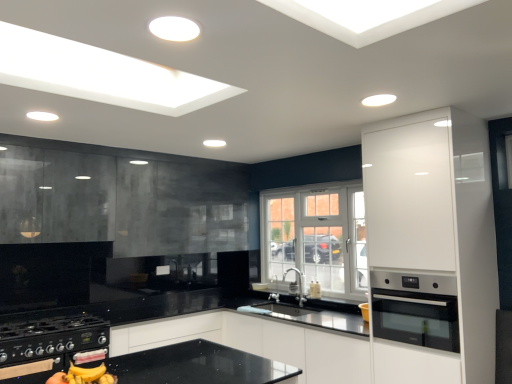
The image size is (512, 384). What do you see at coordinates (415, 309) in the screenshot? I see `stainless steel oven at right` at bounding box center [415, 309].

At what (x,y) coordinates should I click in order to perform the action: click on stainless steel oven at right. Please return your answer as a coordinate pair (x, y). Image resolution: width=512 pixels, height=384 pixels. Looking at the image, I should click on (415, 309).

You are a GUI agent. You are given a task and a screenshot of the screen. Output one action in this format:
    pyautogui.click(x=<x>, y=<y>)
    Task: Click on the white textured window at center
    
    Given the screenshot: What is the action you would take?
    pyautogui.click(x=316, y=237)

Does point (48, 341) come in front of point (300, 287)?

Yes, point (48, 341) is in front of point (300, 287).

Is black matte gas stove at lower left next to satin nickel faucet at center and touching it?

No, black matte gas stove at lower left is not making contact with satin nickel faucet at center.

What are the coordinates of `gas stove below the satin nickel faucet at center (from a real-world perspective)` in the screenshot? It's located at (51, 337).

Which of these two, black matte gas stove at lower left or black glass cabinet at upper left, which is the 1th cabinetry in left-to-right order, stands shorter?

black matte gas stove at lower left.

Is black matte gas stove at lower left oriented towards black glass cabinet at upper left, acting as the second cabinetry starting from the right?

No.

Is black glass cabinet at upper left, acting as the second cabinetry starting from the right, completely or partially inside black matte gas stove at lower left?

No, black glass cabinet at upper left, acting as the second cabinetry starting from the right, is not surrounded by black matte gas stove at lower left.

Does black matte gas stove at lower left have a greater width compared to black glass cabinet at upper left, acting as the second cabinetry starting from the right?

Indeed, black matte gas stove at lower left has a greater width compared to black glass cabinet at upper left, acting as the second cabinetry starting from the right.

Considering the sizes of satin nickel faucet at center and white glossy cabinet at right, which is the second cabinetry in back-to-front order, in the image, is satin nickel faucet at center bigger or smaller than white glossy cabinet at right, which is the second cabinetry in back-to-front order,?

In the image, satin nickel faucet at center appears to be smaller than white glossy cabinet at right, which is the second cabinetry in back-to-front order.

Considering the positions of objects satin nickel faucet at center and white glossy cabinet at right, the first cabinetry from the front, in the image provided, who is behind, satin nickel faucet at center or white glossy cabinet at right, the first cabinetry from the front,?

satin nickel faucet at center.

From a real-world perspective, who is located lower, satin nickel faucet at center or white glossy cabinet at right, the 2th cabinetry positioned from the left?

From a 3D spatial view, satin nickel faucet at center is below.

Looking at this image, is satin nickel faucet at center positioned with its back to white glossy cabinet at right, the 2th cabinetry positioned from the left?

No.

Is black glass cabinet at upper left, the 2th cabinetry from the front, aimed at white textured window at center?

Yes, black glass cabinet at upper left, the 2th cabinetry from the front, is oriented towards white textured window at center.

From a real-world perspective, is black glass cabinet at upper left, which is the first cabinetry from back to front, beneath white textured window at center?

No, from a real-world perspective, black glass cabinet at upper left, which is the first cabinetry from back to front, is not under white textured window at center.

Who is smaller, black glass cabinet at upper left, which is the first cabinetry from back to front, or white textured window at center?

white textured window at center is smaller.

Is black glass cabinet at upper left, the 2th cabinetry from the front, taller or shorter than white textured window at center?

Considering their sizes, black glass cabinet at upper left, the 2th cabinetry from the front, has less height than white textured window at center.

Would you say black matte gas stove at lower left contains white glossy cabinet at right, the 2th cabinetry positioned from the left?

No, black matte gas stove at lower left does not contain white glossy cabinet at right, the 2th cabinetry positioned from the left.

Does black matte gas stove at lower left have a greater width compared to white glossy cabinet at right, the 2th cabinetry positioned from the left?

In fact, black matte gas stove at lower left might be narrower than white glossy cabinet at right, the 2th cabinetry positioned from the left.

Is black matte gas stove at lower left not close to white glossy cabinet at right, which is the second cabinetry in back-to-front order?

Indeed, black matte gas stove at lower left is not near white glossy cabinet at right, which is the second cabinetry in back-to-front order.

Where is `cabinetry below the black glass cabinet at upper left, the 2th cabinetry from the front (from the image's perspective)`? The height and width of the screenshot is (384, 512). cabinetry below the black glass cabinet at upper left, the 2th cabinetry from the front (from the image's perspective) is located at coordinates (432, 240).

Considering the relative sizes of white glossy cabinet at right, which is the second cabinetry in back-to-front order, and black glass cabinet at upper left, which is the 1th cabinetry in left-to-right order, in the image provided, is white glossy cabinet at right, which is the second cabinetry in back-to-front order, thinner than black glass cabinet at upper left, which is the 1th cabinetry in left-to-right order,?

No, white glossy cabinet at right, which is the second cabinetry in back-to-front order, is not thinner than black glass cabinet at upper left, which is the 1th cabinetry in left-to-right order.

How far apart are white glossy cabinet at right, acting as the first cabinetry starting from the right, and black glass cabinet at upper left, the 2th cabinetry from the front?

A distance of 7.51 feet exists between white glossy cabinet at right, acting as the first cabinetry starting from the right, and black glass cabinet at upper left, the 2th cabinetry from the front.

Who is bigger, white glossy cabinet at right, which is the second cabinetry in back-to-front order, or black glass cabinet at upper left, which is the first cabinetry from back to front?

black glass cabinet at upper left, which is the first cabinetry from back to front.

Is satin nickel faucet at center bigger than white textured window at center?

No, satin nickel faucet at center is not bigger than white textured window at center.

Is there a large distance between satin nickel faucet at center and white textured window at center?

No, there isn't a large distance between satin nickel faucet at center and white textured window at center.

Who is shorter, satin nickel faucet at center or white textured window at center?

satin nickel faucet at center is shorter.

The height and width of the screenshot is (384, 512). What are the coordinates of `tap that is on the right side of black matte gas stove at lower left` in the screenshot? It's located at (298, 284).

Where is `gas stove below the black glass cabinet at upper left, which is the first cabinetry from back to front (from the image's perspective)`? gas stove below the black glass cabinet at upper left, which is the first cabinetry from back to front (from the image's perspective) is located at coordinates (51, 337).

Considering their positions, is black glass cabinet at upper left, the 2th cabinetry from the front, positioned further to white glossy cabinet at right, acting as the first cabinetry starting from the right, than white textured window at center?

Based on the image, black glass cabinet at upper left, the 2th cabinetry from the front, appears to be further to white glossy cabinet at right, acting as the first cabinetry starting from the right.

Estimate the real-world distances between objects in this image. Which object is closer to white glossy cabinet at right, acting as the first cabinetry starting from the right, black glass cabinet at upper left, acting as the second cabinetry starting from the right, or stainless steel oven at right?

stainless steel oven at right is closer to white glossy cabinet at right, acting as the first cabinetry starting from the right.

Looking at the image, which one is located closer to satin nickel faucet at center, black matte gas stove at lower left or white textured window at center?

white textured window at center is closer to satin nickel faucet at center.

Based on their spatial positions, is stainless steel oven at right or white glossy cabinet at right, which is the second cabinetry in back-to-front order, closer to black matte gas stove at lower left?

Based on the image, stainless steel oven at right appears to be nearer to black matte gas stove at lower left.

Estimate the real-world distances between objects in this image. Which object is closer to black glass cabinet at upper left, which is the 1th cabinetry in left-to-right order, satin nickel faucet at center or stainless steel oven at right?

satin nickel faucet at center lies closer to black glass cabinet at upper left, which is the 1th cabinetry in left-to-right order, than the other object.

Estimate the real-world distances between objects in this image. Which object is further from black matte gas stove at lower left, stainless steel oven at right or white textured window at center?

stainless steel oven at right is positioned further to the anchor black matte gas stove at lower left.

Which object lies nearer to the anchor point white textured window at center, satin nickel faucet at center or stainless steel oven at right?

satin nickel faucet at center.

Estimate the real-world distances between objects in this image. Which object is closer to satin nickel faucet at center, white textured window at center or stainless steel oven at right?

The object closer to satin nickel faucet at center is white textured window at center.

Where is `tap between black glass cabinet at upper left, the 2th cabinetry from the front, and white textured window at center`? This screenshot has width=512, height=384. tap between black glass cabinet at upper left, the 2th cabinetry from the front, and white textured window at center is located at coordinates [x=298, y=284].

Identify the location of tap between black matte gas stove at lower left and white textured window at center in the horizontal direction. (298, 284).

I want to click on window between stainless steel oven at right and satin nickel faucet at center in the front-back direction, so click(316, 237).

This screenshot has width=512, height=384. I want to click on oven between white glossy cabinet at right, the 2th cabinetry positioned from the left, and white textured window at center from front to back, so click(x=415, y=309).